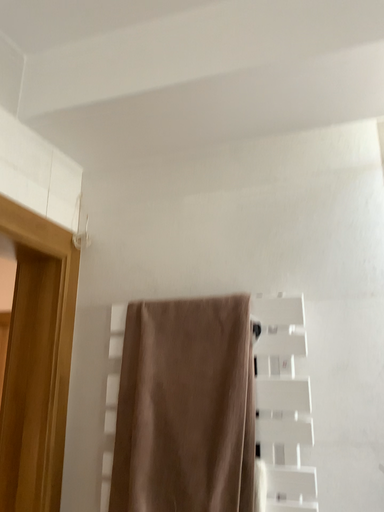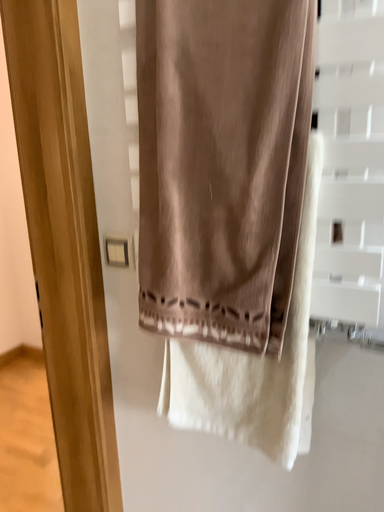
Question: Which way did the camera rotate in the video?

Choices:
 (A) rotated left
 (B) rotated right

Answer: (A)